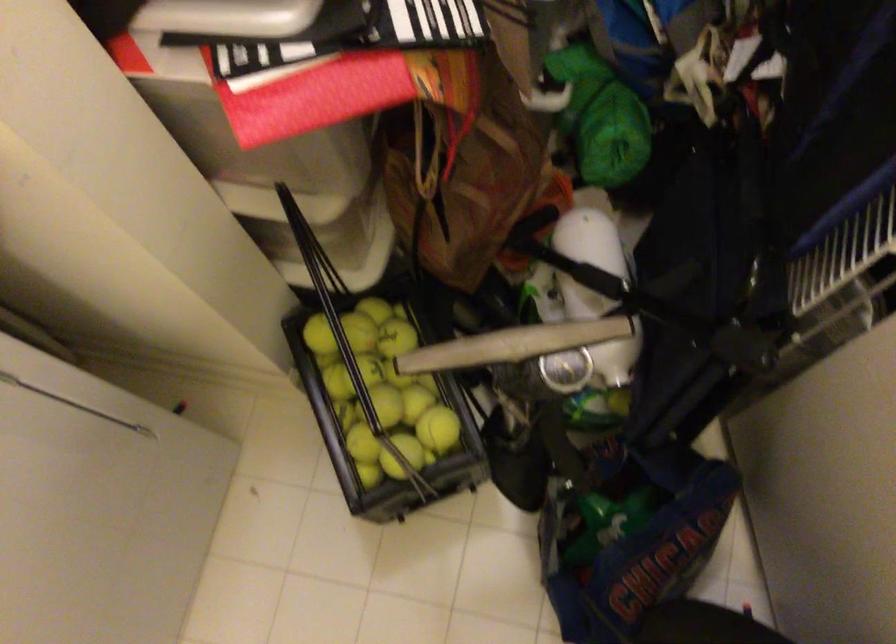
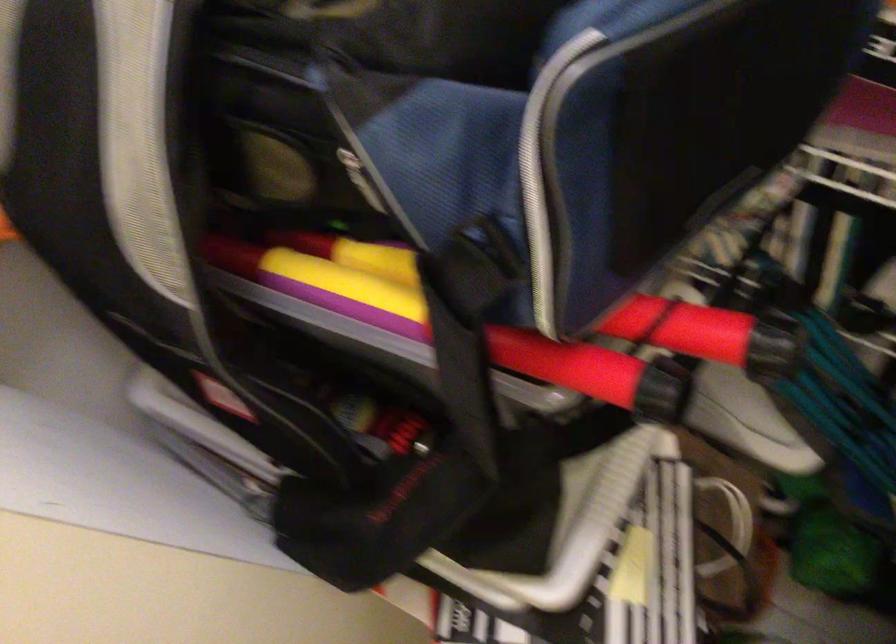
Question: Based on the continuous images, in which direction is the camera rotating? Reply with the corresponding letter.

Choices:
 (A) Left
 (B) Right
 (C) Up
 (D) Down

Answer: (A)